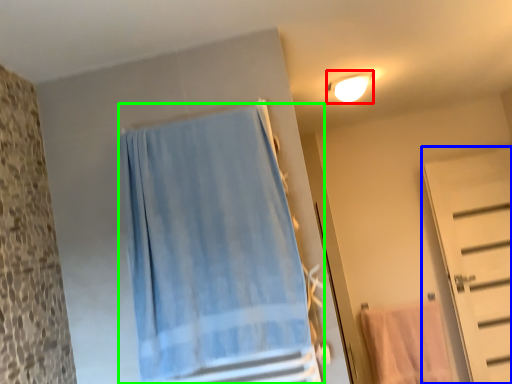
Question: Which is farther away from light fixture (highlighted by a red box)? door (highlighted by a blue box) or curtain (highlighted by a green box)?

Choices:
 (A) door
 (B) curtain

Answer: (A)